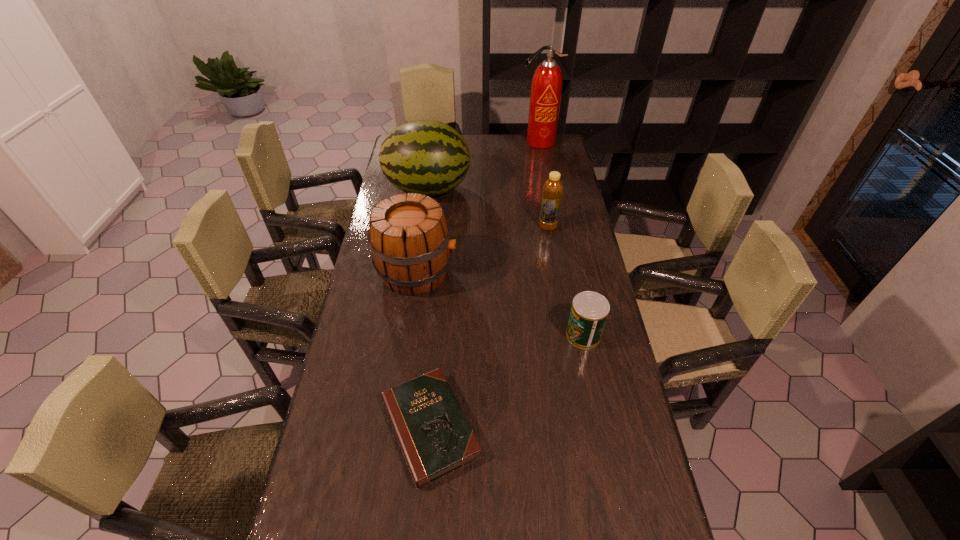
Where is `bottle that is at the right edge`? bottle that is at the right edge is located at coordinates (552, 191).

Image resolution: width=960 pixels, height=540 pixels. Find the location of `can at the right edge`. can at the right edge is located at coordinates click(x=589, y=311).

The width and height of the screenshot is (960, 540). Find the location of `object located in the far right corner section of the desktop`. object located in the far right corner section of the desktop is located at coordinates (546, 88).

Where is `free space at the far edge`? Image resolution: width=960 pixels, height=540 pixels. free space at the far edge is located at coordinates (510, 152).

The image size is (960, 540). In the image, there is a desktop. In order to click on vacant space at the left edge in this screenshot , I will do `click(382, 198)`.

Find the location of `vacant area at the right edge`. vacant area at the right edge is located at coordinates (563, 201).

Image resolution: width=960 pixels, height=540 pixels. In order to click on free space between the fire extinguisher and the shortest object in this screenshot , I will do `click(484, 285)`.

Where is `free space between the tallest object and the cider`? free space between the tallest object and the cider is located at coordinates click(x=478, y=207).

In order to click on free space between the nearest object and the fifth nearest object in this screenshot , I will do `click(429, 308)`.

Find the location of a particular element. The height and width of the screenshot is (540, 960). free space between the second farthest object and the tallest object is located at coordinates (483, 166).